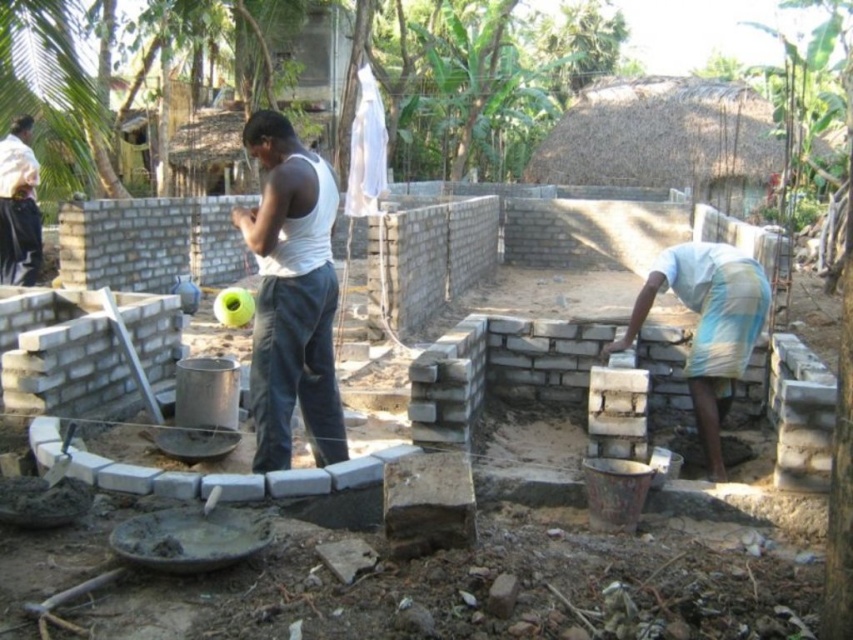
Question: Does white matte tank top at center appear on the left side of light blue plaid shorts at lower right?

Choices:
 (A) yes
 (B) no

Answer: (A)

Question: Which object is closer to the camera taking this photo?

Choices:
 (A) white matte tank top at center
 (B) gray brick wall at center
 (C) white cotton shirt at upper left

Answer: (B)

Question: Which object is positioned farthest from the white matte tank top at center?

Choices:
 (A) light blue plaid shorts at lower right
 (B) gray brick wall at center

Answer: (B)

Question: Is light blue plaid shorts at lower right behind white cotton shirt at upper left?

Choices:
 (A) no
 (B) yes

Answer: (A)

Question: Which of these objects is positioned farthest from the gray brick wall at center?

Choices:
 (A) white matte tank top at center
 (B) light blue plaid shorts at lower right

Answer: (A)

Question: Where is gray brick wall at center located in relation to light blue plaid shorts at lower right in the image?

Choices:
 (A) right
 (B) left

Answer: (B)